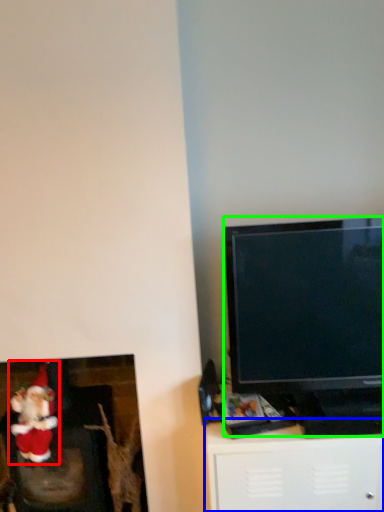
Question: Considering the real-world distances, which object is closest to santa claus (highlighted by a red box)? furniture (highlighted by a blue box) or television (highlighted by a green box).

Choices:
 (A) furniture
 (B) television

Answer: (A)